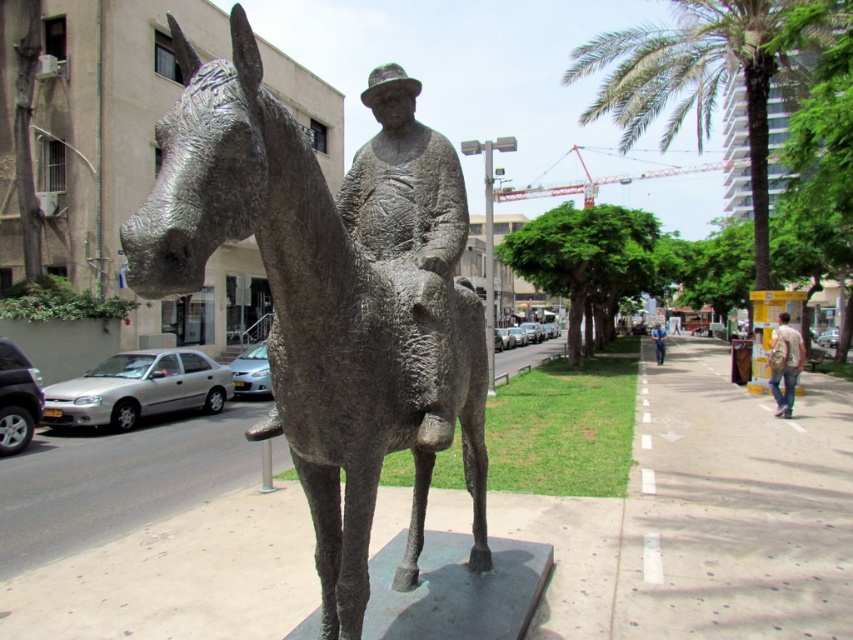
Is green leafy palm tree at upper right bigger than light brown leather jacket at lower right?

Yes.

Is point (746, 81) positioned in front of point (788, 412)?

No, it is behind (788, 412).

Which is in front, point (628, 140) or point (786, 406)?

Positioned in front is point (786, 406).

You are a GUI agent. You are given a task and a screenshot of the screen. Output one action in this format:
    pyautogui.click(x=<x>, y=<y>)
    Task: Click on the green leafy palm tree at upper right
    The width and height of the screenshot is (853, 640).
    Given the screenshot: What is the action you would take?
    pyautogui.click(x=709, y=77)

How far apart are bronze statue at center and green leafy palm tree at upper right?

bronze statue at center is 13.49 meters from green leafy palm tree at upper right.

Is point (271, 289) less distant than point (659, 97)?

Yes, it is.

Image resolution: width=853 pixels, height=640 pixels. I want to click on bronze statue at center, so click(331, 294).

Is bronze statue at center closer to the viewer compared to light brown leather jacket at lower right?

Yes, bronze statue at center is closer to the viewer.

Measure the distance between point (x=378, y=275) and camera.

They are 2.68 meters apart.

Locate an element on the screen. The height and width of the screenshot is (640, 853). bronze statue at center is located at coordinates (331, 294).